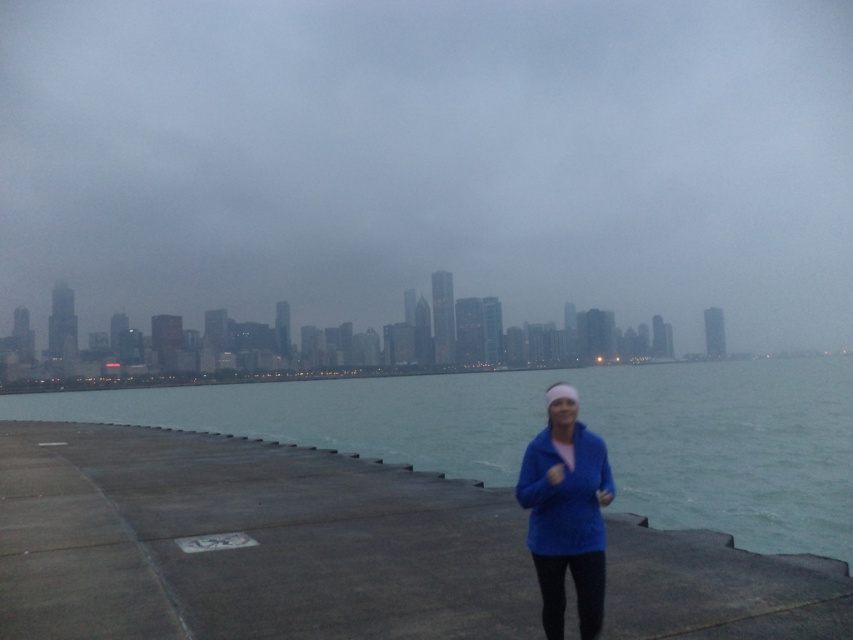
You are a photographer trying to capture the foggy skyline at center and the blue fleece jacket at lower right in a single shot. Which object should you focus on first to ensure both are in frame?

The foggy skyline at center is above the blue fleece jacket at lower right, so you should focus on the blue fleece jacket at lower right first to ensure both are in frame.